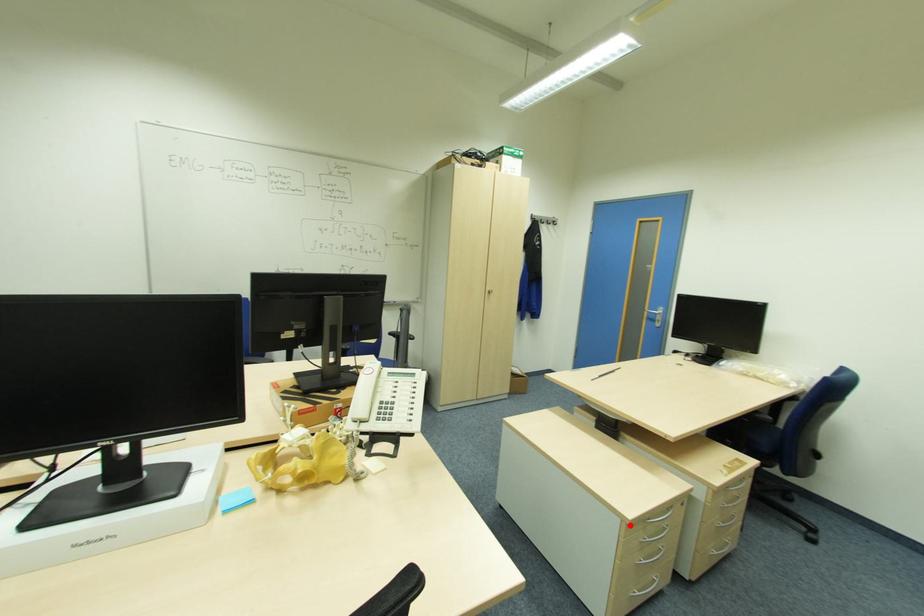
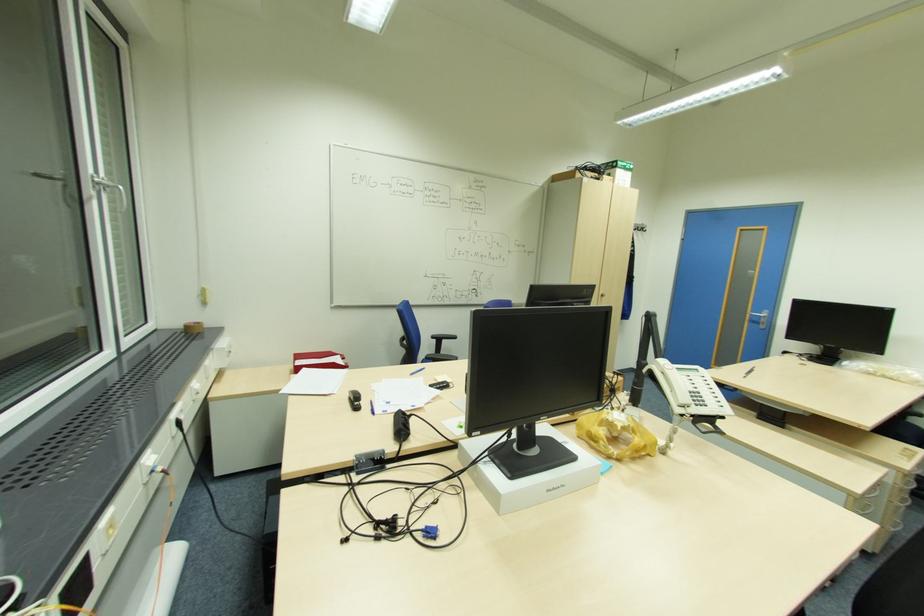
Find the pixel in the second image that matches the highlighted location in the first image.

(857, 498)